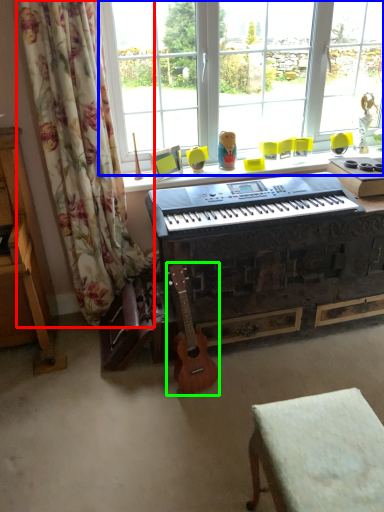
Question: Considering the real-world distances, which object is closest to curtain (highlighted by a red box)? window screen (highlighted by a blue box) or guitar (highlighted by a green box).

Choices:
 (A) window screen
 (B) guitar

Answer: (B)